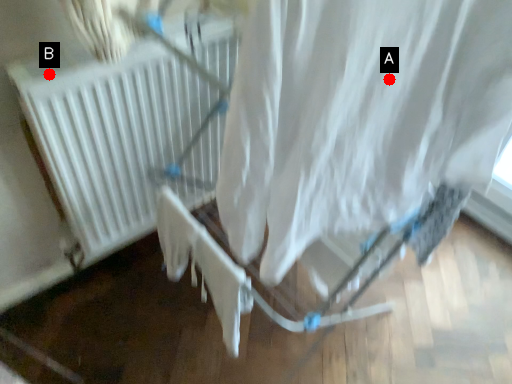
Question: Two points are circled on the image, labeled by A and B beside each circle. Which point is farther to the camera?

Choices:
 (A) A is further
 (B) B is further

Answer: (B)